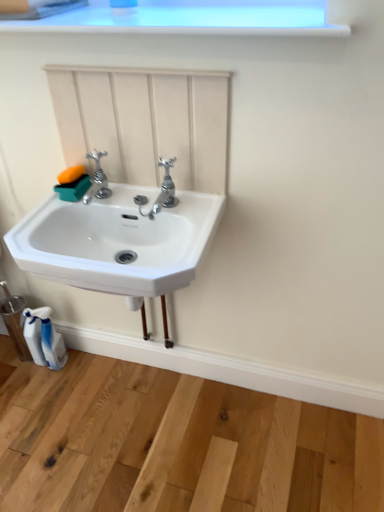
Identify the location of blank space to the left of polished chrome tap at center, placed as the 2th tap when sorted from right to left. The width and height of the screenshot is (384, 512). (49, 213).